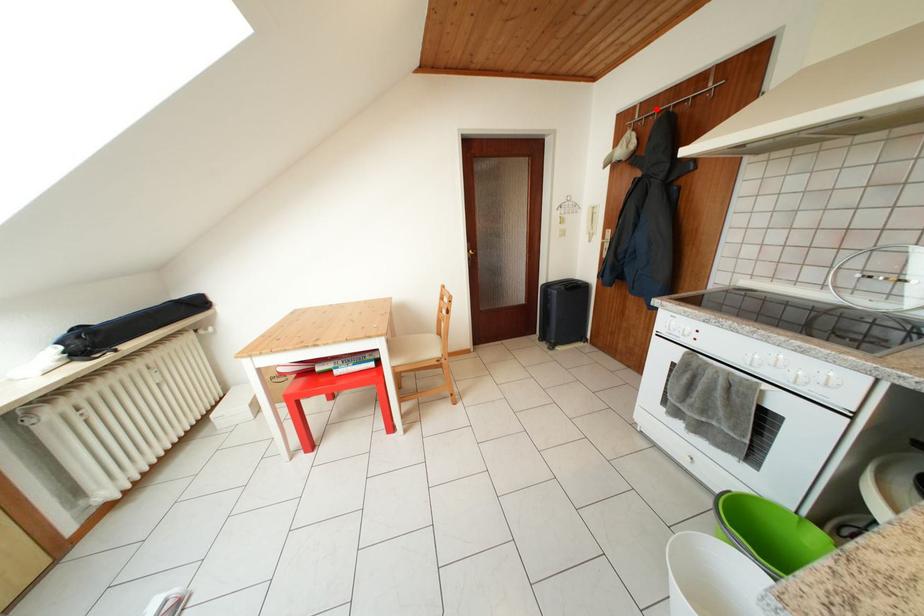
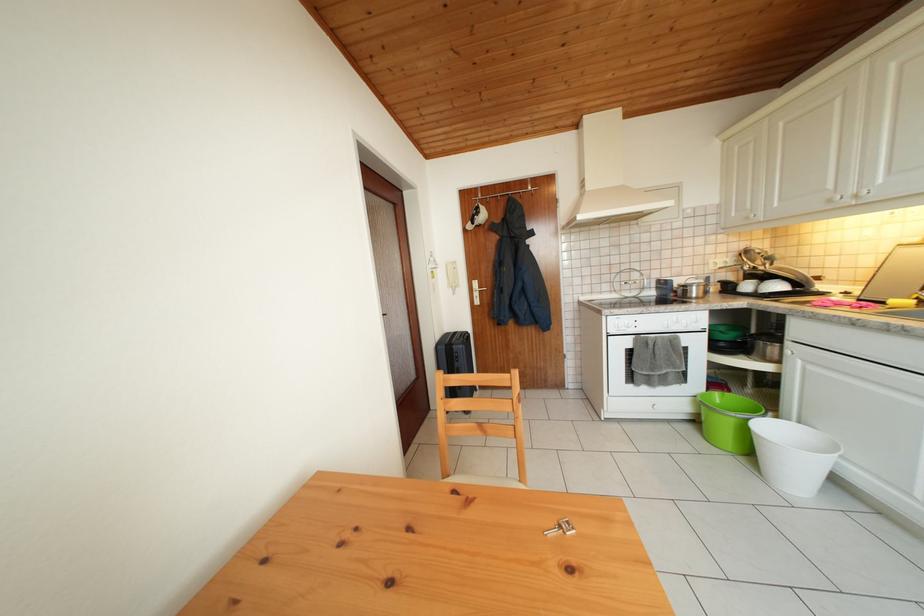
Locate, in the second image, the point that corresponds to the highlighted location in the first image.

(494, 193)